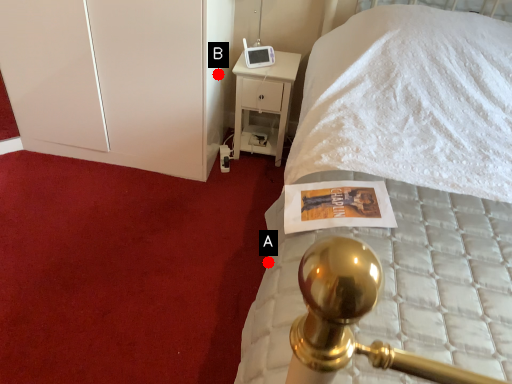
Question: Two points are circled on the image, labeled by A and B beside each circle. Which point is closer to the camera?

Choices:
 (A) A is closer
 (B) B is closer

Answer: (A)